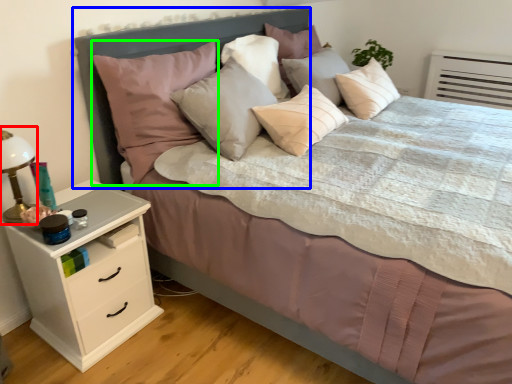
Question: Which object is the closest to the bedside lamp (highlighted by a red box)? Choose among these: headboard (highlighted by a blue box) or pillow (highlighted by a green box).

Choices:
 (A) headboard
 (B) pillow

Answer: (B)